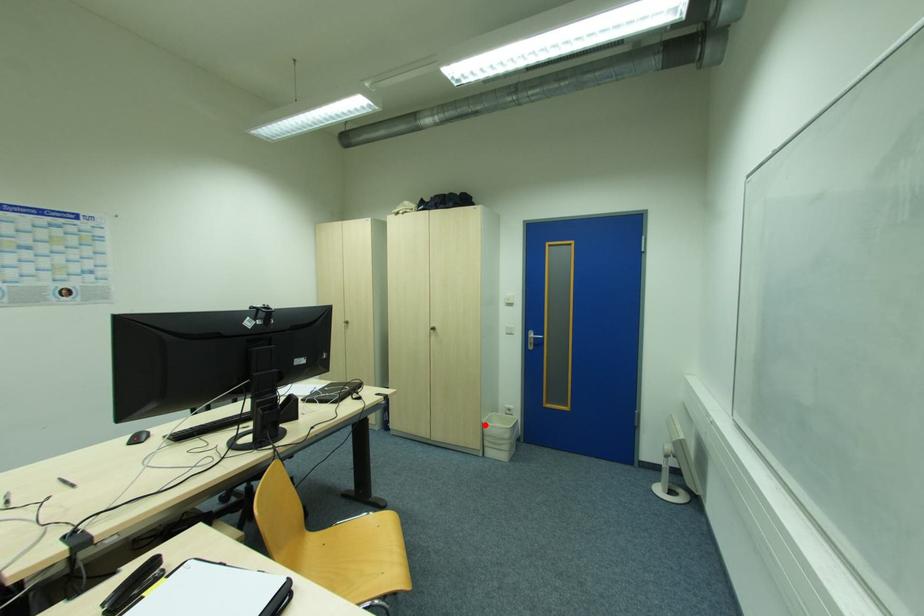
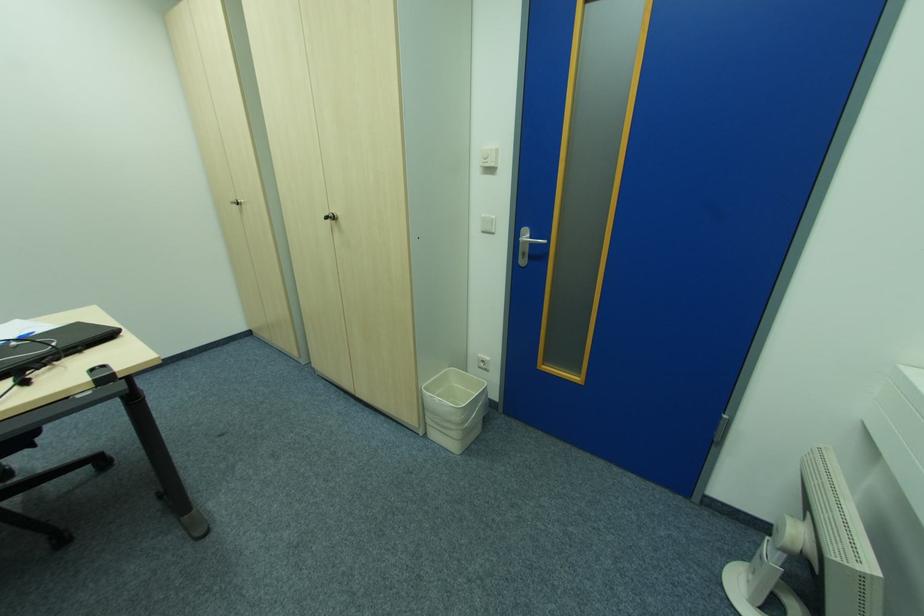
In the second image, find the point that corresponds to the highlighted location in the first image.

(424, 391)